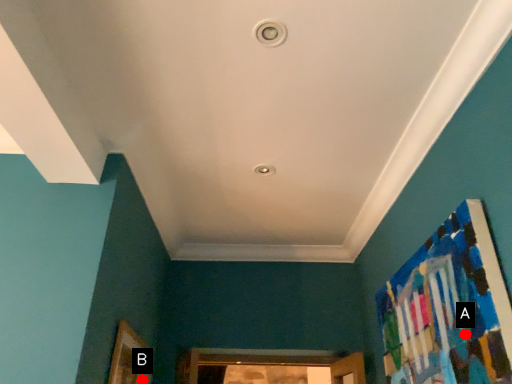
Question: Two points are circled on the image, labeled by A and B beside each circle. Among these points, which one is farthest from the camera?

Choices:
 (A) A is further
 (B) B is further

Answer: (B)